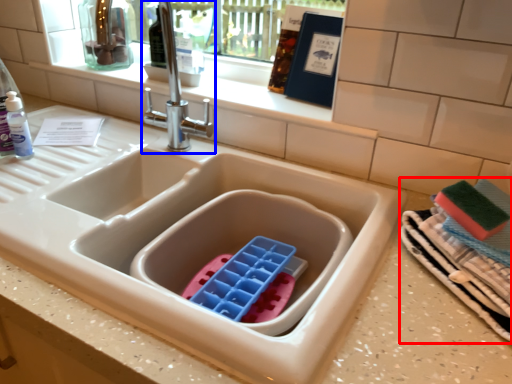
Question: Which point is further to the camera, laundry (highlighted by a red box) or tap (highlighted by a blue box)?

Choices:
 (A) laundry
 (B) tap

Answer: (B)